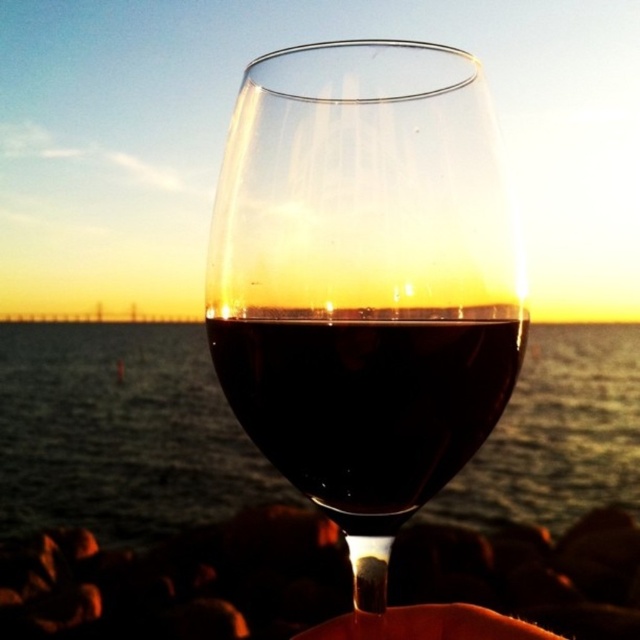
Question: Which point appears farthest from the camera in this image?

Choices:
 (A) (376, 44)
 (B) (324, 634)

Answer: (B)

Question: Which point is farther from the camera taking this photo?

Choices:
 (A) (518, 627)
 (B) (208, 465)
 (C) (365, 472)
 (D) (355, 520)

Answer: (B)

Question: Does transparent liquid at center have a smaller size compared to matte skin hand at center?

Choices:
 (A) yes
 (B) no

Answer: (B)

Question: Observing the image, what is the correct spatial positioning of transparent liquid at center in reference to matte skin hand at center?

Choices:
 (A) above
 (B) below

Answer: (A)

Question: Considering the real-world distances, which object is closest to the shiny dark red wine at center?

Choices:
 (A) transparent glass at center
 (B) matte skin hand at center

Answer: (A)

Question: Where is shiny dark red wine at center located in relation to matte skin hand at center in the image?

Choices:
 (A) right
 (B) left

Answer: (B)